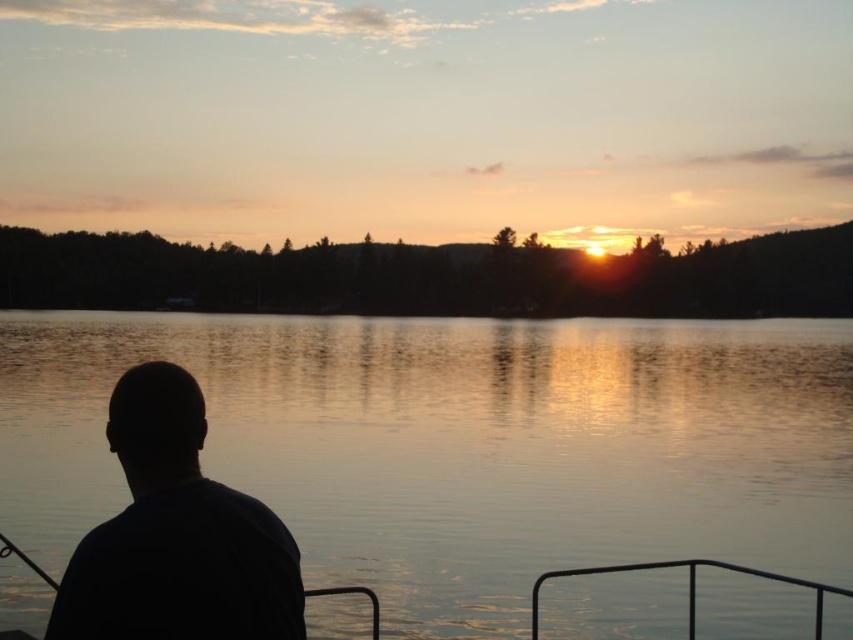
Is silvery water at center closer to the viewer compared to black metal rail at lower right?

That is True.

Between silvery water at center and black metal rail at lower right, which one is positioned higher?

Positioned higher is silvery water at center.

This screenshot has height=640, width=853. I want to click on silvery water at center, so click(459, 445).

Is black matte shirt at lower left in front of black metal rail at lower right?

Yes, it is.

Who is more distant from viewer, (283, 618) or (743, 566)?

The point (743, 566) is behind.

Locate an element on the screen. The image size is (853, 640). black matte shirt at lower left is located at coordinates (177, 536).

Is silvery water at center below black matte shirt at lower left?

Indeed, silvery water at center is positioned under black matte shirt at lower left.

This screenshot has width=853, height=640. Describe the element at coordinates (459, 445) in the screenshot. I see `silvery water at center` at that location.

Is point (834, 392) positioned in front of point (247, 589)?

That is False.

Image resolution: width=853 pixels, height=640 pixels. I want to click on silvery water at center, so click(x=459, y=445).